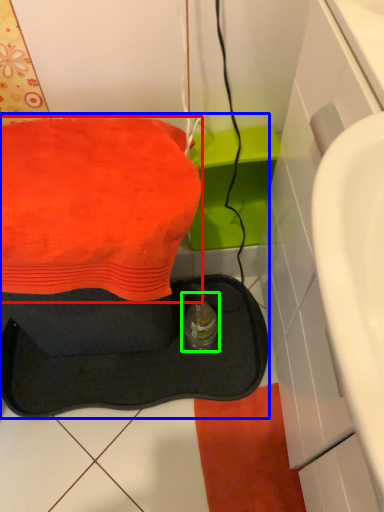
Question: Considering the real-world distances, which object is farthest from towel (highlighted by a red box)? sink (highlighted by a blue box) or bottle (highlighted by a green box)?

Choices:
 (A) sink
 (B) bottle

Answer: (A)